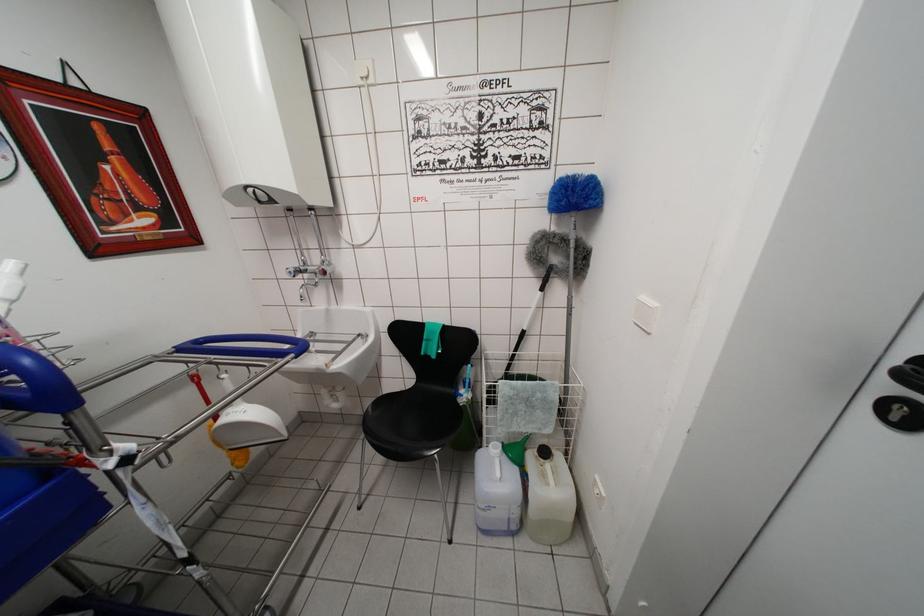
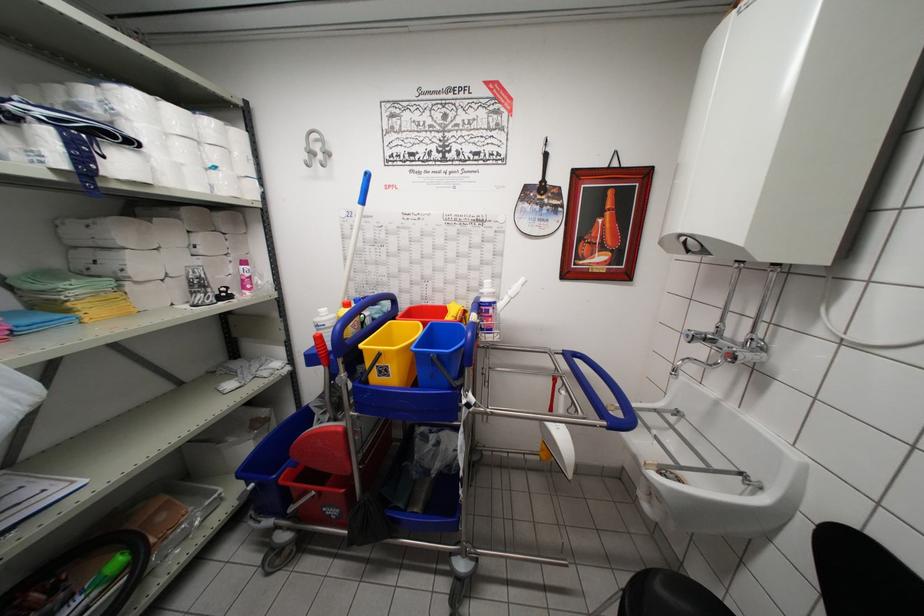
Based on the continuous images, in which direction is the camera rotating?

The rotation direction of the camera is left-down.